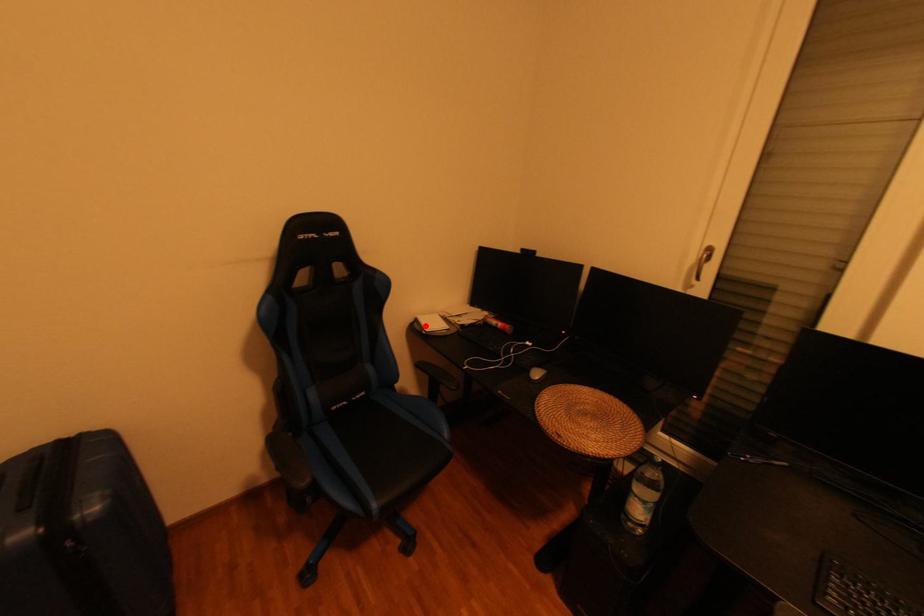
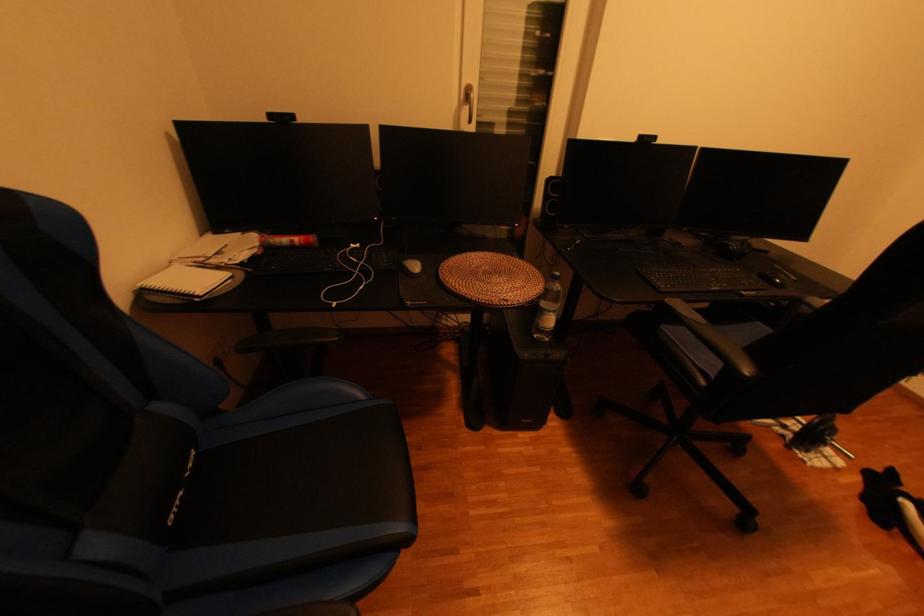
In the second image, find the point that corresponds to the highlighted location in the first image.

(164, 299)